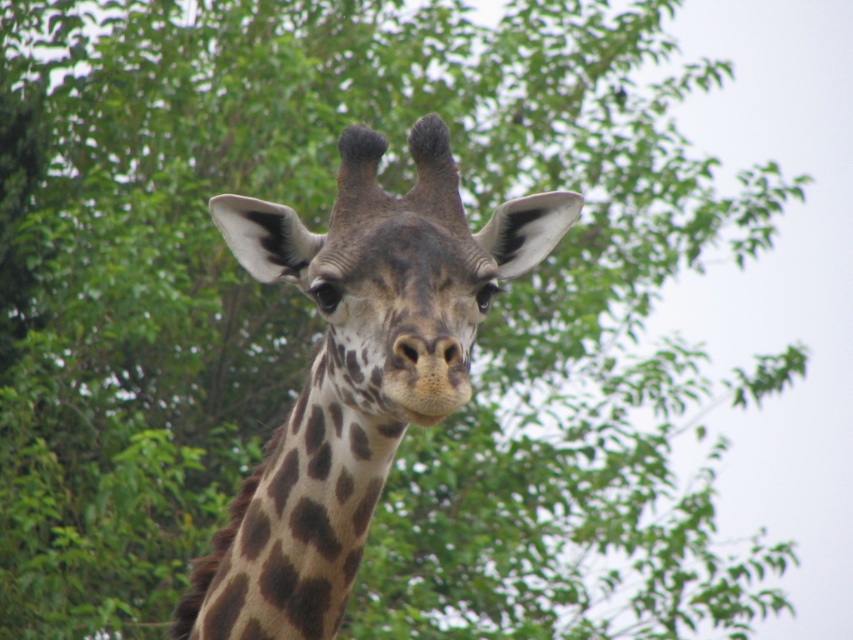
Who is higher up, brown spotted giraffe at center or brown spotted neck at center?

brown spotted giraffe at center is higher up.

Which is behind, point (236, 573) or point (283, 604)?

The point (236, 573) is more distant.

Where is `brown spotted giraffe at center`? brown spotted giraffe at center is located at coordinates (355, 372).